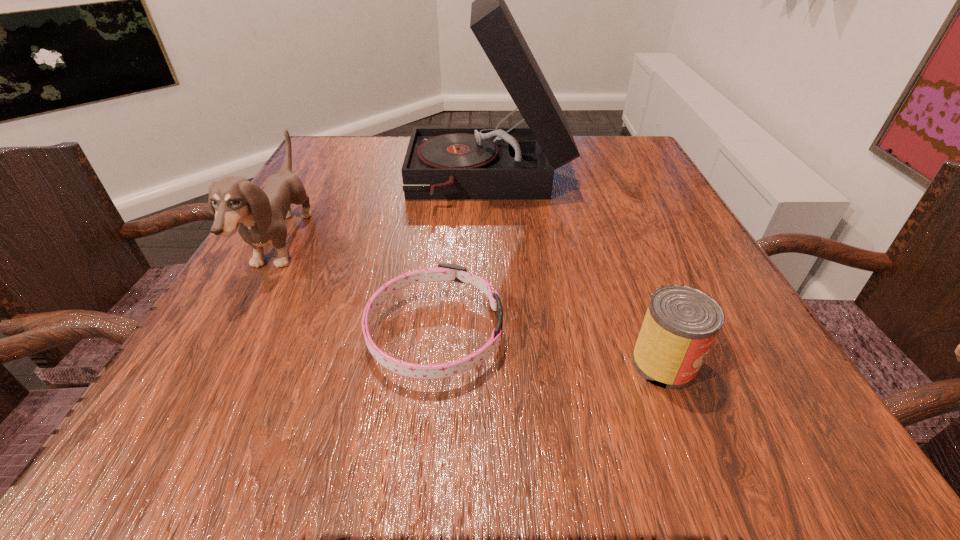
Where is `free space between the puppy and the shortest object`? This screenshot has height=540, width=960. free space between the puppy and the shortest object is located at coordinates (358, 289).

The height and width of the screenshot is (540, 960). I want to click on free space between the phonograph_record and the rightmost object, so click(x=576, y=272).

Locate an element on the screen. The image size is (960, 540). vacant area that lies between the second shortest object and the dog collar is located at coordinates (549, 348).

Image resolution: width=960 pixels, height=540 pixels. I want to click on vacant point located between the leftmost object and the tallest object, so click(385, 213).

You are a GUI agent. You are given a task and a screenshot of the screen. Output one action in this format:
    pyautogui.click(x=<x>, y=<y>)
    Task: Click on the third closest object relative to the second shortest object
    This screenshot has width=960, height=540.
    Given the screenshot: What is the action you would take?
    pyautogui.click(x=258, y=215)

Select which object is the third closest to the can. Please provide its 2D coordinates. Your answer should be formatted as a tuple, i.e. [(x, y)], where the tuple contains the x and y coordinates of a point satisfying the conditions above.

[(258, 215)]

Locate an element on the screen. The image size is (960, 540). vacant point that satisfies the following two spatial constraints: 1. with the buckle on the shortest object; 2. on the right side of the second shortest object is located at coordinates (432, 363).

Where is `vacant region that satisfies the following two spatial constraints: 1. with the buckle on the can; 2. on the right side of the shortest object`? The width and height of the screenshot is (960, 540). vacant region that satisfies the following two spatial constraints: 1. with the buckle on the can; 2. on the right side of the shortest object is located at coordinates (432, 363).

Image resolution: width=960 pixels, height=540 pixels. I want to click on blank space that satisfies the following two spatial constraints: 1. on the front-facing side of the tallest object; 2. on the right side of the rightmost object, so click(x=493, y=363).

Locate an element on the screen. vacant space that satisfies the following two spatial constraints: 1. at the face of the leftmost object; 2. on the left side of the second shortest object is located at coordinates (214, 363).